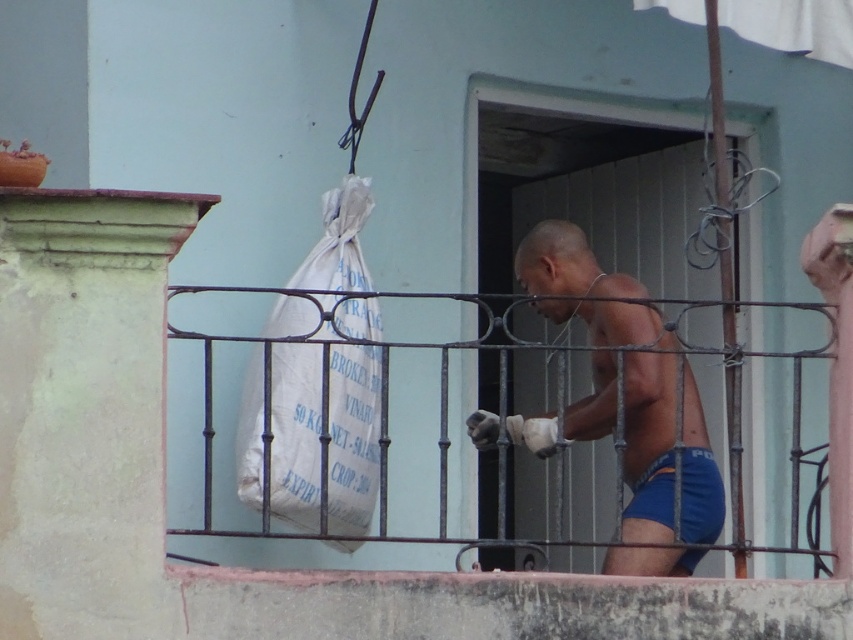
Question: Considering the real-world distances, which object is farthest from the white fabric sack at center?

Choices:
 (A) rusty metal cage at center
 (B) blue fabric shorts at lower right
 (C) blue fabric shorts at center

Answer: (A)

Question: Does white fabric sack at center have a lesser width compared to blue fabric shorts at lower right?

Choices:
 (A) no
 (B) yes

Answer: (A)

Question: Estimate the real-world distances between objects in this image. Which object is closer to the rusty metal cage at center?

Choices:
 (A) blue fabric shorts at lower right
 (B) blue fabric shorts at center
 (C) white fabric sack at center

Answer: (B)

Question: Which is nearer to the blue fabric shorts at lower right?

Choices:
 (A) rusty metal cage at center
 (B) blue fabric shorts at center
 (C) white fabric sack at center

Answer: (B)

Question: Can you confirm if blue fabric shorts at center is positioned above blue fabric shorts at lower right?

Choices:
 (A) yes
 (B) no

Answer: (A)

Question: Does blue fabric shorts at center have a larger size compared to rusty metal cage at center?

Choices:
 (A) no
 (B) yes

Answer: (B)